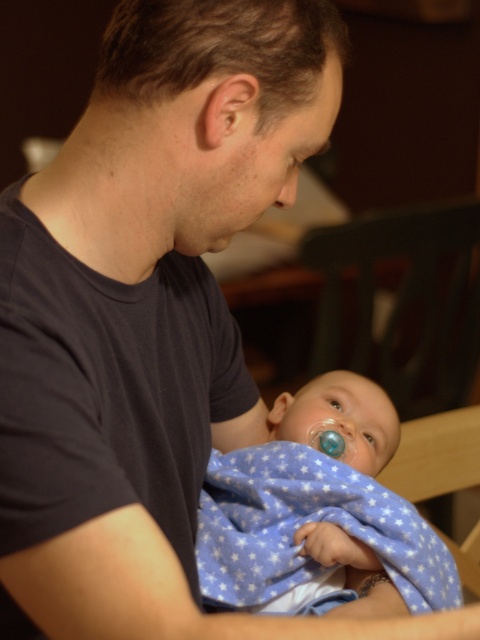
You are a photographer standing 36 inches away from the blue flannel blanket at center. Can you reach it without moving your feet?

The blue flannel blanket at center is 33.86 inches away from the viewer. Since you are standing 36 inches away, you are slightly farther than the blanket. However, if you can extend your arm about 2.14 inches further, you might be able to reach it without moving your feet.

You are standing in front of the scene and want to reach the point marked at coordinates point (261, 561). If your hand can extend 30 inches forward, will you be able to touch that point?

The point marked at coordinates point (261, 561) is 34.82 inches away from you. Since your hand can only extend 30 inches forward, you won

You are a photographer adjusting the focus of your camera. You want to ensure that both the blue flannel blanket at center and the translucent blue pacifier at center are clearly visible. Since the blanket and pacifier are at different distances from the camera, which object should you focus on first to ensure the pacifier is in focus?

The blue flannel blanket at center is in front of the translucent blue pacifier at center. To ensure the pacifier is in focus, you should focus on the blue flannel blanket at center first, as it is closer to the camera. This way, the depth of field will extend backward to include the pacifier, which is behind the blanket.